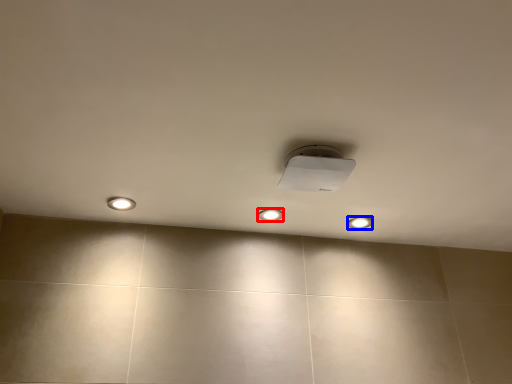
Question: Which point is further to the camera, dot (highlighted by a red box) or dot (highlighted by a blue box)?

Choices:
 (A) dot
 (B) dot

Answer: (B)